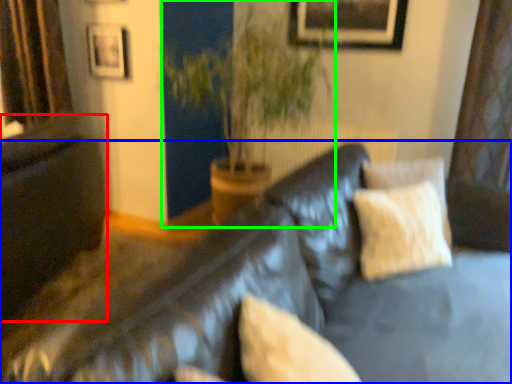
Question: Based on their relative distances, which object is nearer to dark (highlighted by a red box)? Choose from studio couch (highlighted by a blue box) and houseplant (highlighted by a green box).

Choices:
 (A) studio couch
 (B) houseplant

Answer: (B)